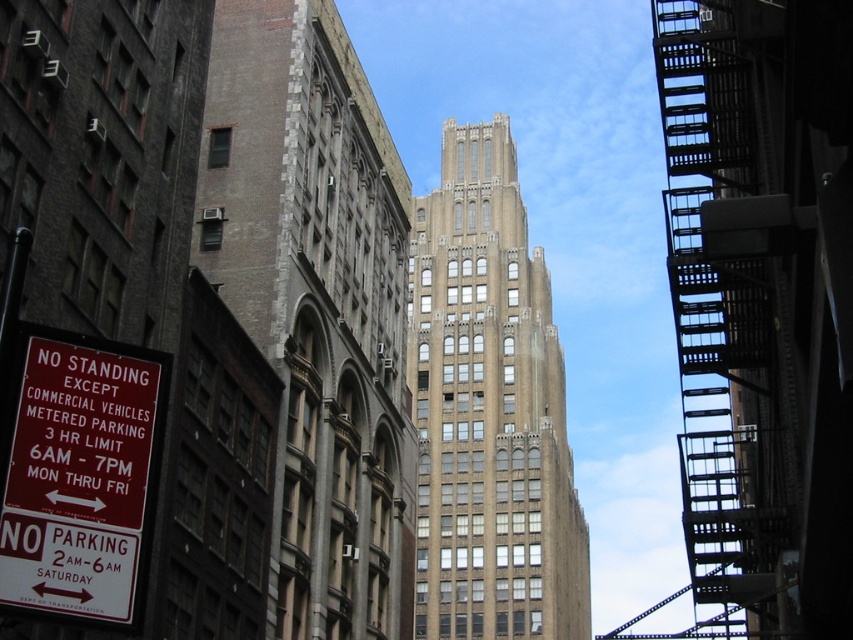
Which of these two, brown stone building at center or red plastic sign at lower left, stands taller?

brown stone building at center is taller.

Who is lower down, brown stone building at center or red plastic sign at lower left?

red plastic sign at lower left

Where is `brown stone building at center`? brown stone building at center is located at coordinates (316, 305).

Does brown stone building at center have a lesser height compared to brown stone tower at center?

Indeed, brown stone building at center has a lesser height compared to brown stone tower at center.

Between brown stone building at center and brown stone tower at center, which one has less height?

brown stone building at center is shorter.

Where is `brown stone building at center`? This screenshot has width=853, height=640. brown stone building at center is located at coordinates (316, 305).

Locate an element on the screen. The width and height of the screenshot is (853, 640). brown stone building at center is located at coordinates (316, 305).

Does brown stone tower at center appear on the left side of red plastic sign at lower left?

Incorrect, brown stone tower at center is not on the left side of red plastic sign at lower left.

Between brown stone tower at center and red plastic sign at lower left, which one has more height?

Standing taller between the two is brown stone tower at center.

Which is in front, point (515, 579) or point (86, 378)?

Positioned in front is point (86, 378).

The image size is (853, 640). I want to click on brown stone tower at center, so click(489, 410).